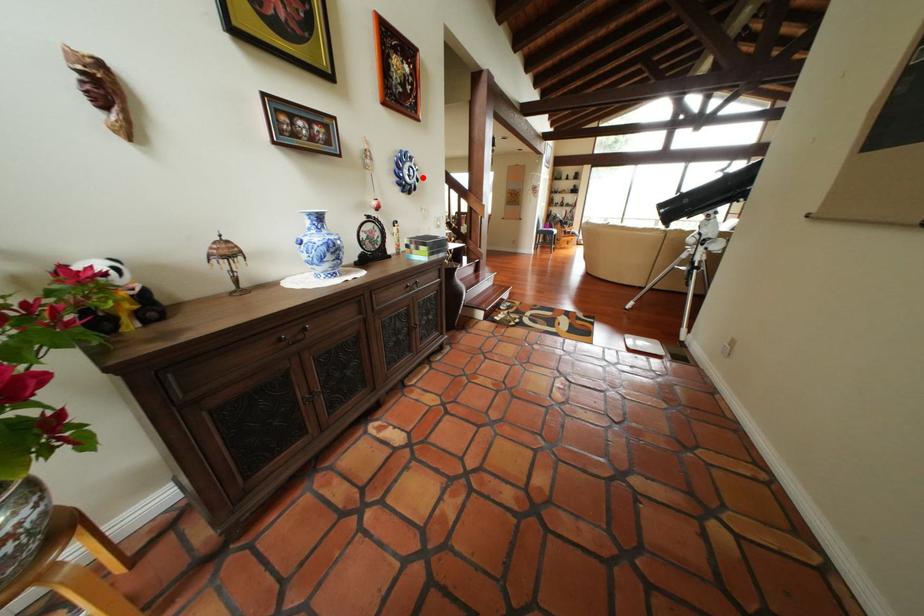
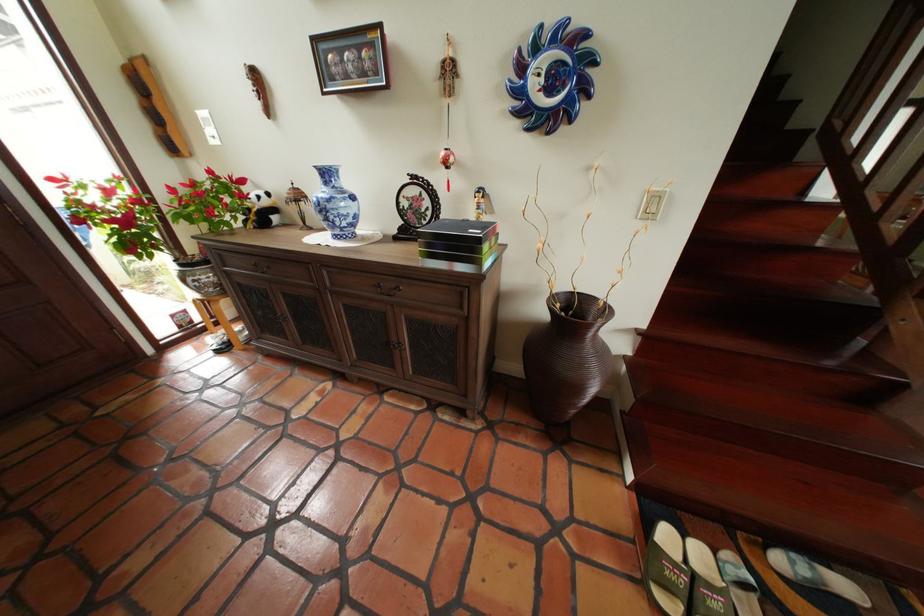
Find the pixel in the second image that matches the highlighted location in the first image.

(563, 91)